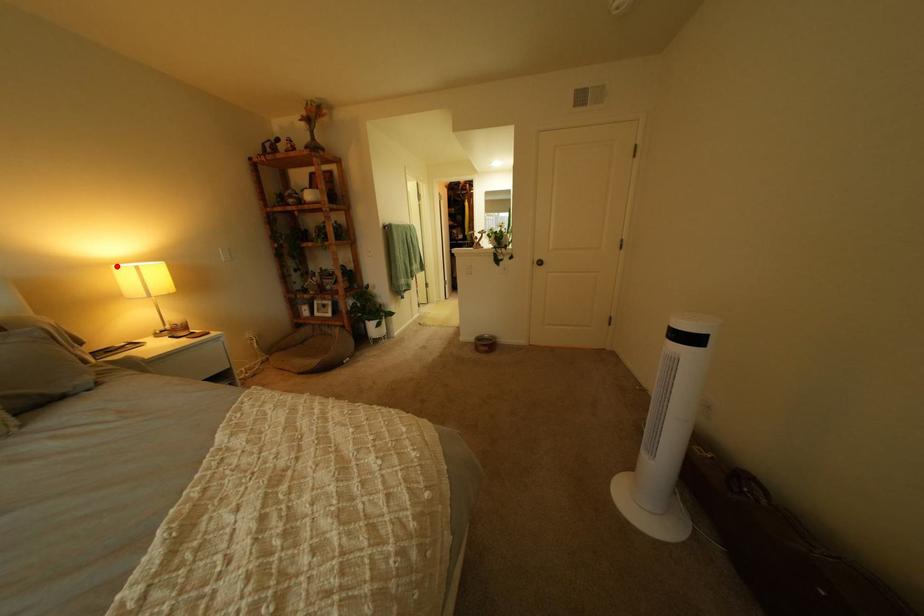
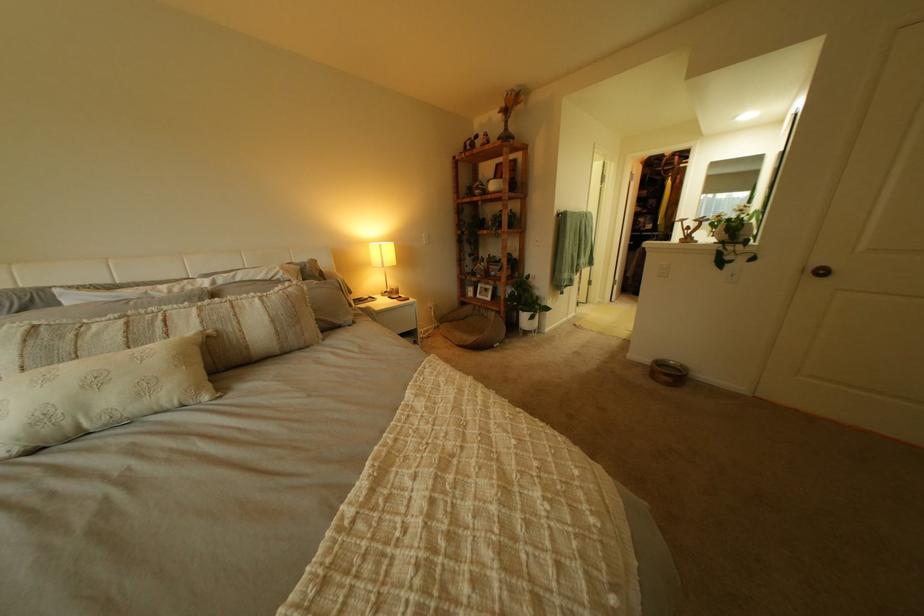
The point at the highlighted location is marked in the first image. Where is the corresponding point in the second image?

(381, 244)